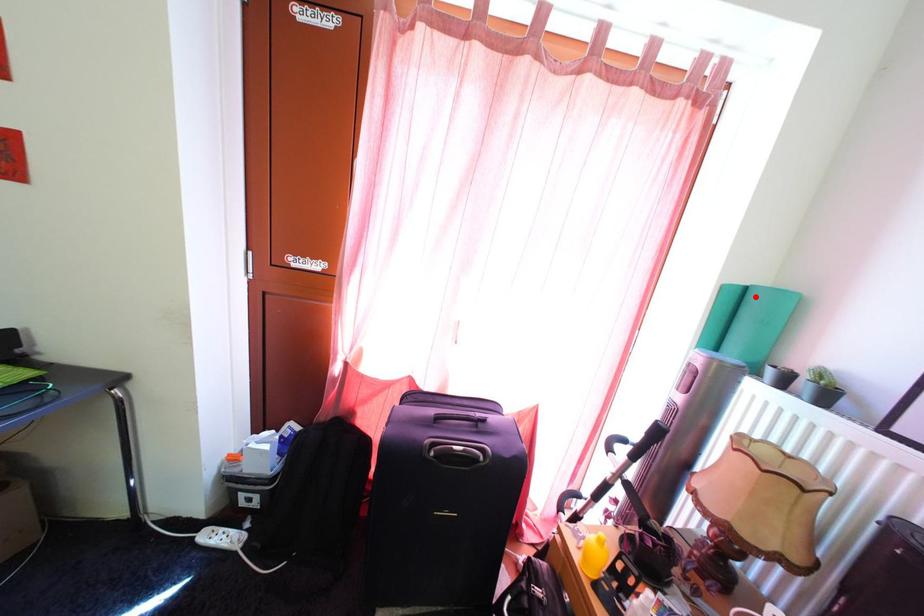
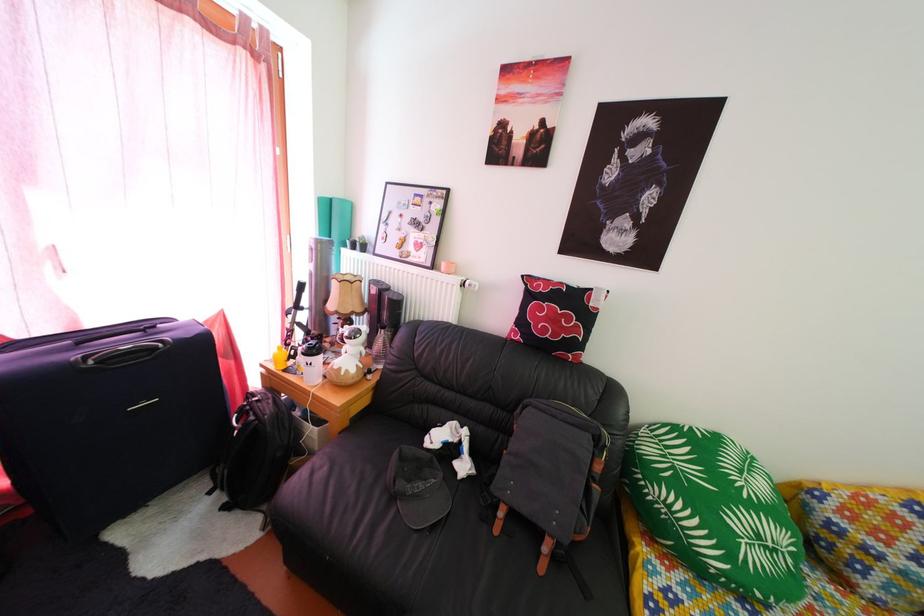
In the second image, find the point that corresponds to the highlighted location in the first image.

(339, 208)